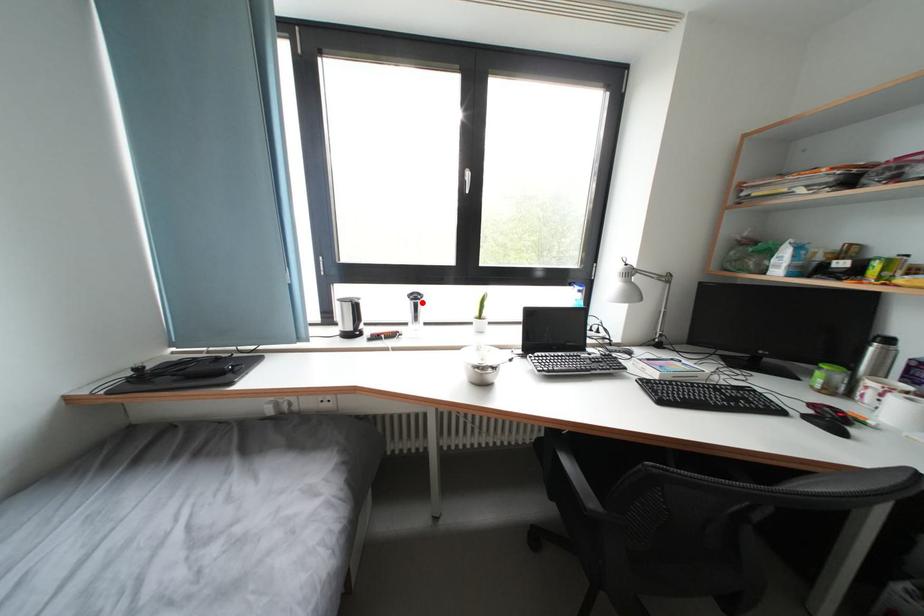
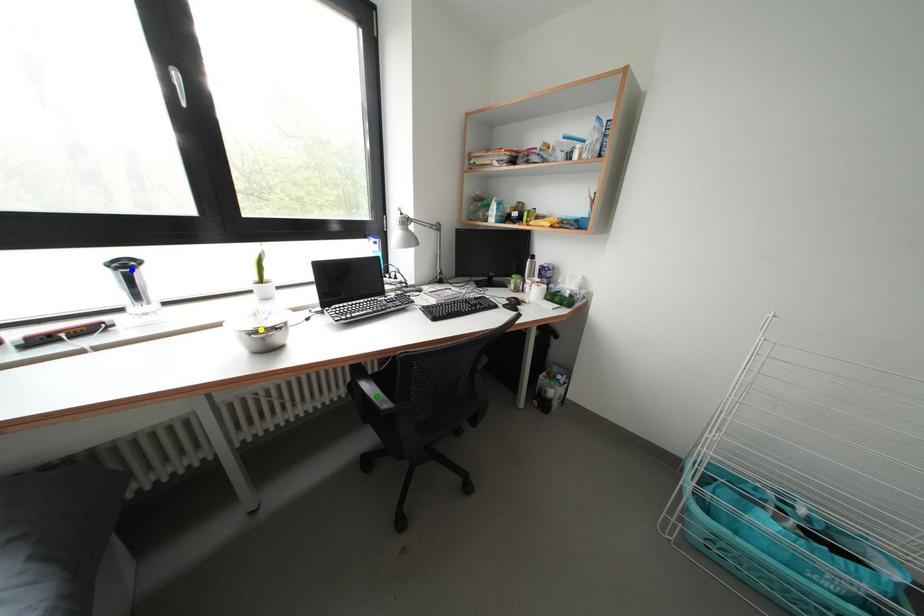
Question: I am providing you with two images of the same scene from different viewpoints. A red point is marked on the first image. You are given multiple points on the second image. In image 2, which mark is for the same physical point as the one in image 1?

Choices:
 (A) yellow point
 (B) blue point
 (C) green point

Answer: (B)